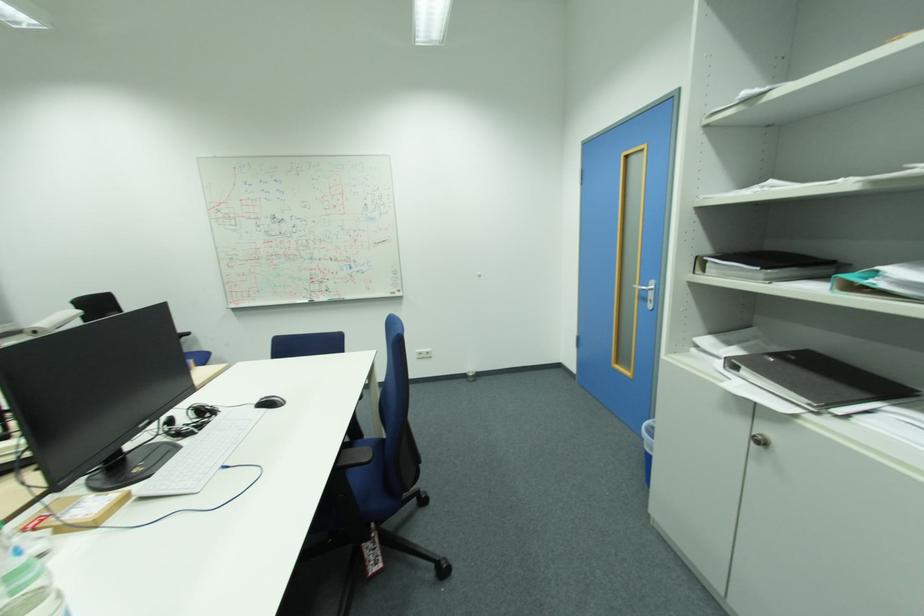
Where is `blue chair sitting surface`? The width and height of the screenshot is (924, 616). blue chair sitting surface is located at coordinates (371, 491).